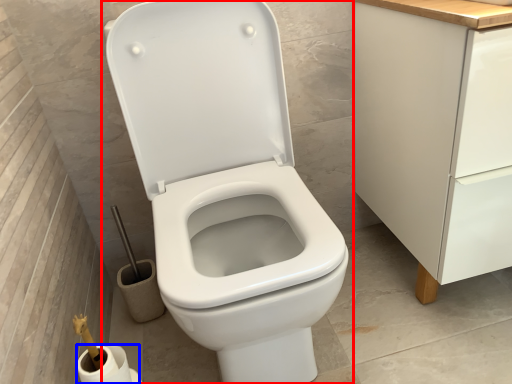
Question: Which of the following is the farthest to the observer, toilet (highlighted by a red box) or toilet paper (highlighted by a blue box)?

Choices:
 (A) toilet
 (B) toilet paper

Answer: (B)